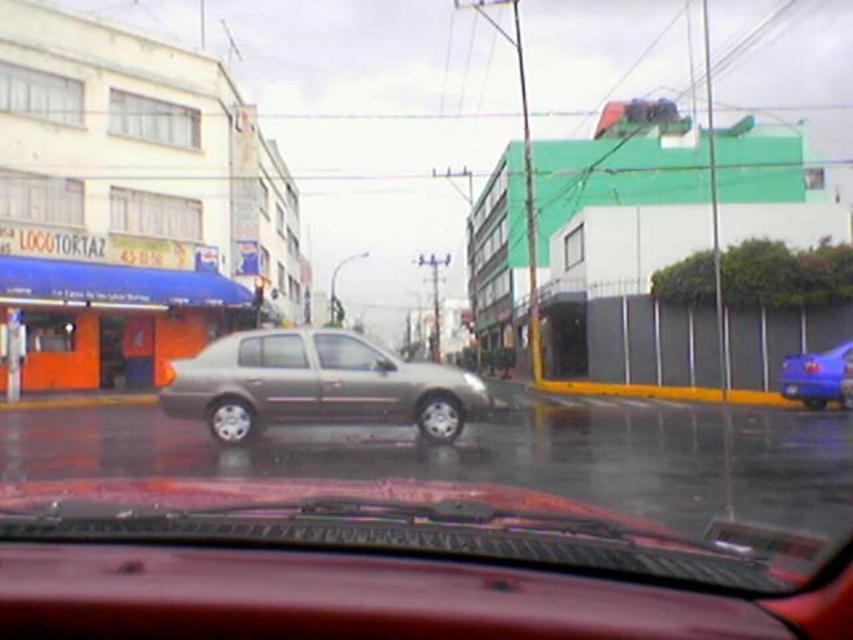
In the scene shown: You are a passenger in the car and want to know which object, the blue metallic van at right or the satin silver car window at center, will block your view of the LOCO TARTAZ building on the left. Based on their sizes, which one is more likely to obstruct your view?

The blue metallic van at right is larger in size than the satin silver car window at center, so the blue metallic van at right is more likely to obstruct your view of the LOCO TARTAZ building on the left.

You are a passenger in the satin silver sedan at center. You want to look at the road ahead through the satin silver car window at center. Can you see the road clearly through the window?

The satin silver sedan at center is much taller than the satin silver car window at center, so the window might be positioned lower, allowing you to see the road clearly through the satin silver car window at center.

You are a passenger in the vehicle and want to look at the LOCO TARTAZ building on the left. Which object in the scene would block your view of the building? Please choose between the satin silver sedan at center and the satin silver car window at center.

The satin silver sedan at center is bigger than the satin silver car window at center, so the satin silver sedan at center would block your view of the LOCO TARTAZ building on the left.